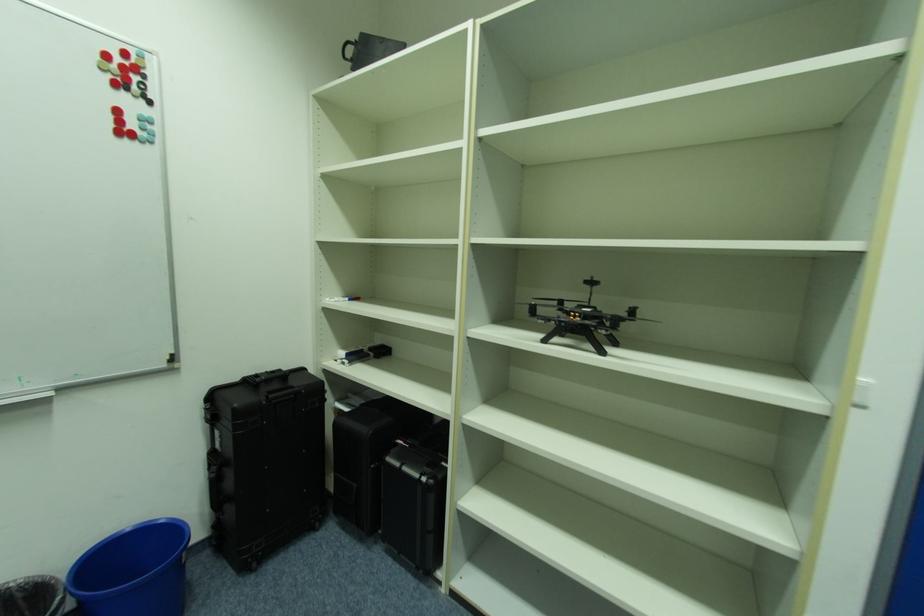
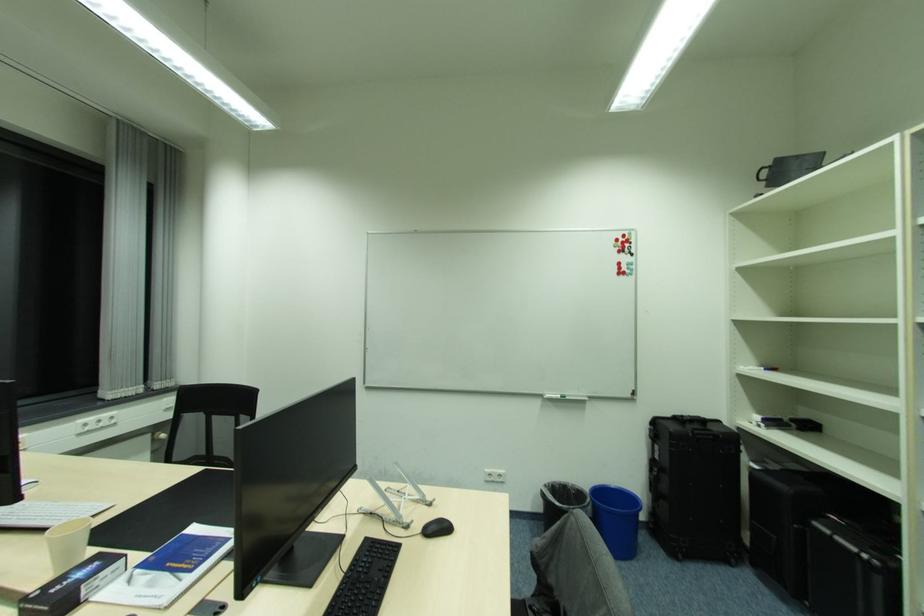
Question: The camera is either moving clockwise (left) or counter-clockwise (right) around the object. The first image is from the beginning of the video and the second image is from the end. Is the camera moving left or right when shooting the video?

Choices:
 (A) Left
 (B) Right

Answer: (B)